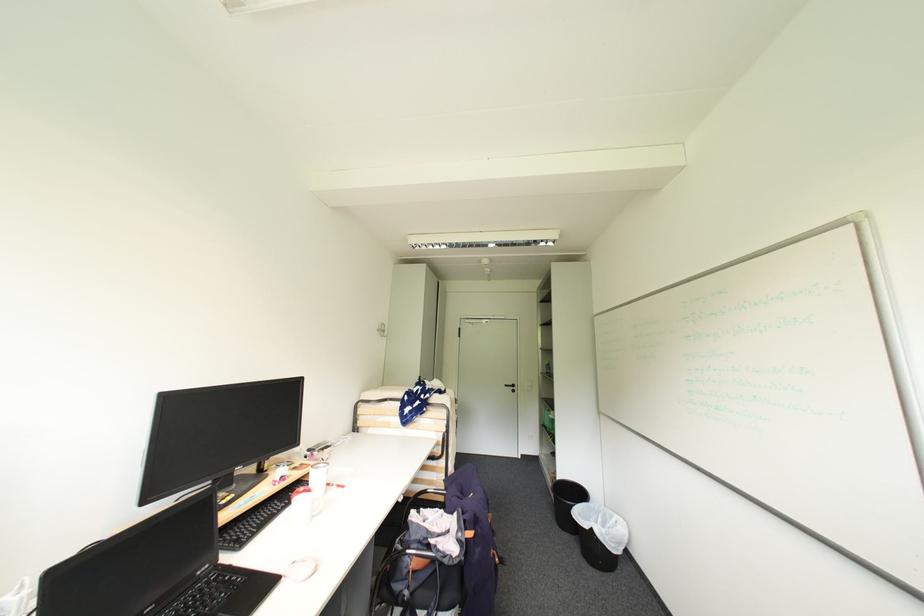
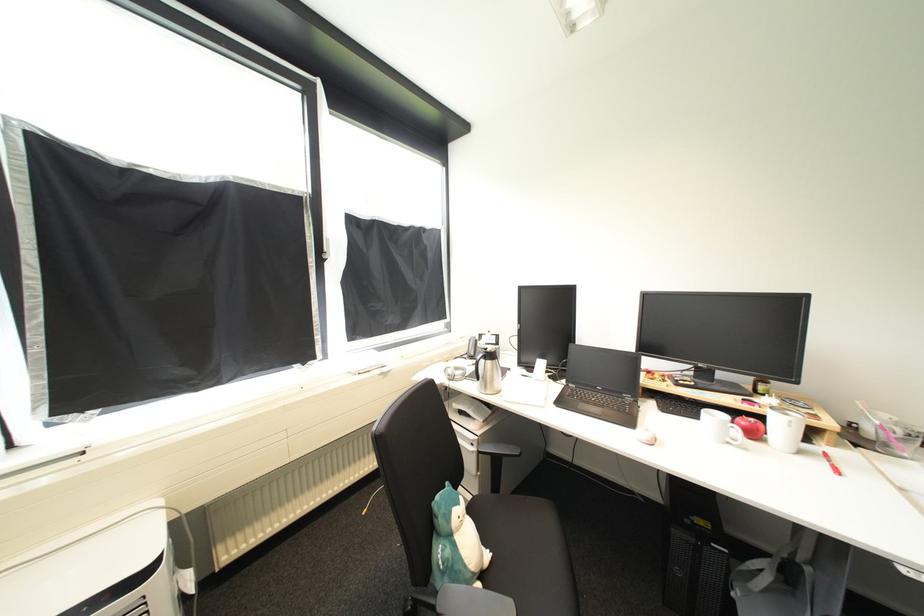
The point at (319, 517) is marked in the first image. Where is the corresponding point in the second image?

(736, 445)